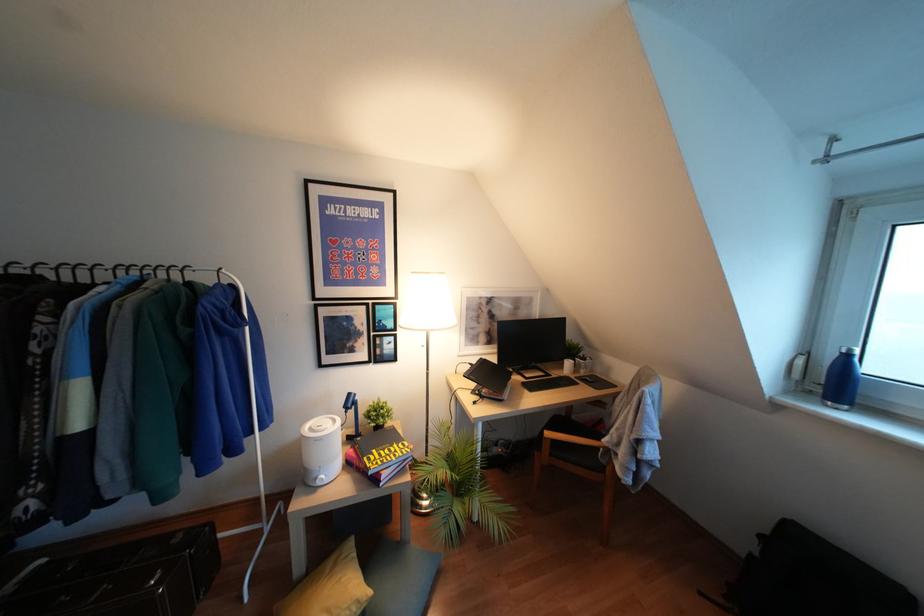
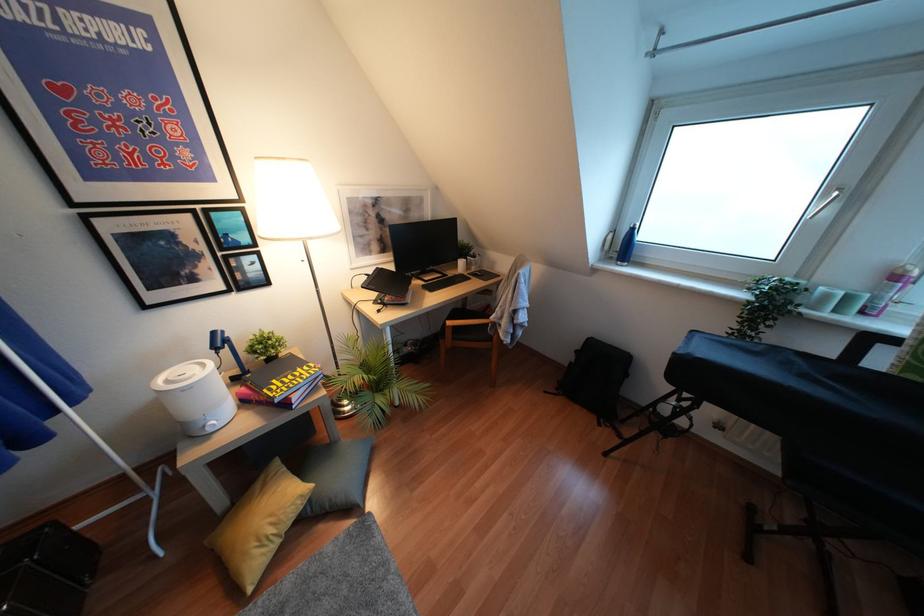
How did the camera likely rotate?

The camera rotated toward right-down.